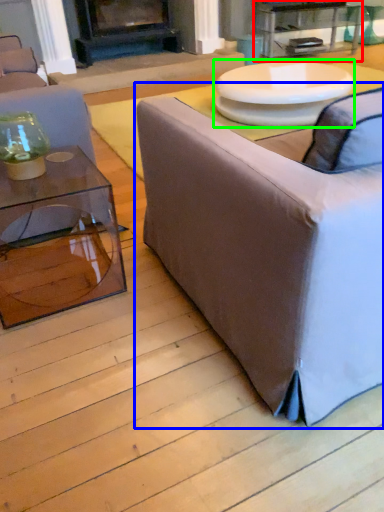
Question: Which is farther away from table (highlighted by a red box)? studio couch (highlighted by a blue box) or round table (highlighted by a green box)?

Choices:
 (A) studio couch
 (B) round table

Answer: (A)